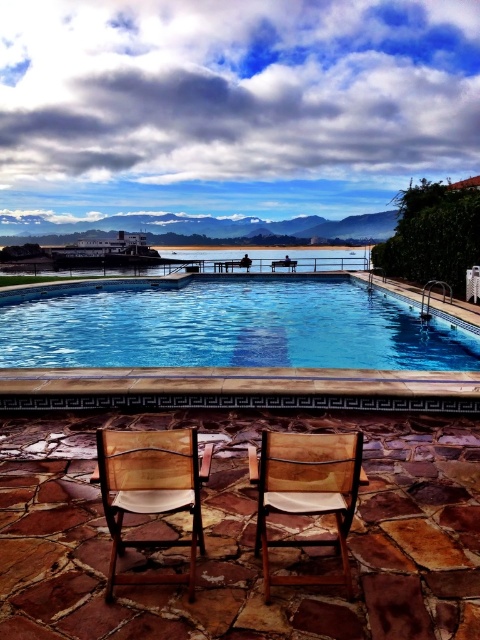
Can you confirm if blue glassy swimming pool at center is taller than wooden chair at lower center?

Yes.

Can you confirm if blue glassy swimming pool at center is positioned below wooden chair at lower center?

Incorrect, blue glassy swimming pool at center is not positioned below wooden chair at lower center.

The width and height of the screenshot is (480, 640). Identify the location of blue glassy swimming pool at center. (226, 326).

Where is `blue glassy swimming pool at center`? blue glassy swimming pool at center is located at coordinates (226, 326).

Can you confirm if wooden chair at lower center is bigger than wooden chair with white cushion at center?

Yes, wooden chair at lower center is bigger than wooden chair with white cushion at center.

What do you see at coordinates (151, 492) in the screenshot? The height and width of the screenshot is (640, 480). I see `wooden chair at lower center` at bounding box center [151, 492].

Find the location of a particular element. This screenshot has width=480, height=640. wooden chair at lower center is located at coordinates (151, 492).

Is blue glassy swimming pool at center shorter than wooden chair with white cushion at center?

In fact, blue glassy swimming pool at center may be taller than wooden chair with white cushion at center.

Who is higher up, blue glassy swimming pool at center or wooden chair with white cushion at center?

blue glassy swimming pool at center is above.

Is point (320, 316) behind point (257, 536)?

Yes, point (320, 316) is farther from viewer.

I want to click on blue glassy swimming pool at center, so click(226, 326).